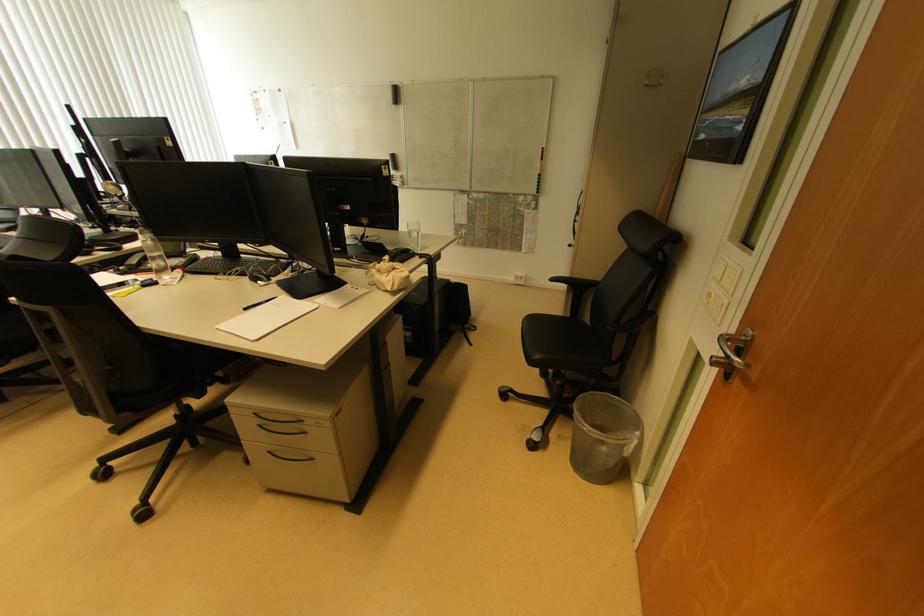
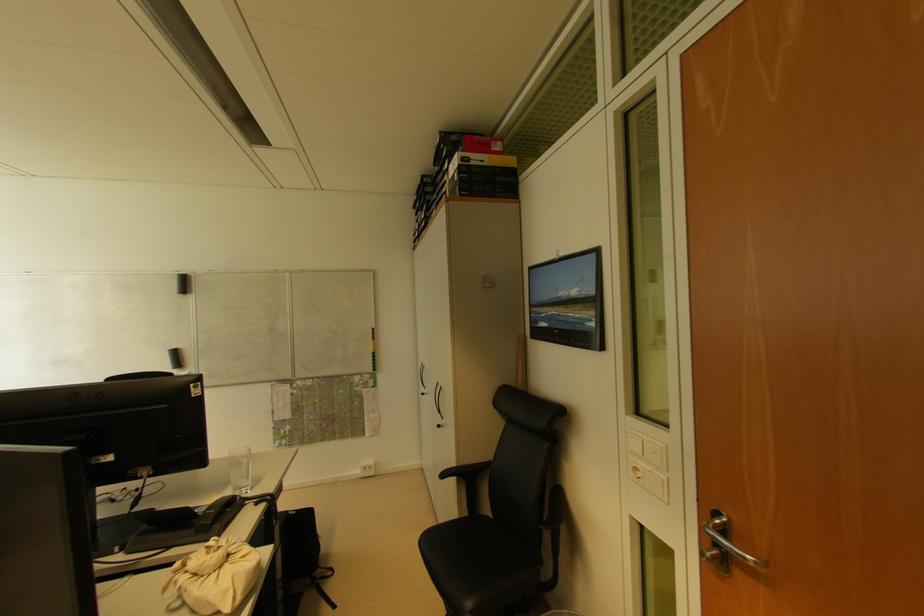
Where in the second image is the point corresponding to pixel 748 344 from the first image?

(726, 527)